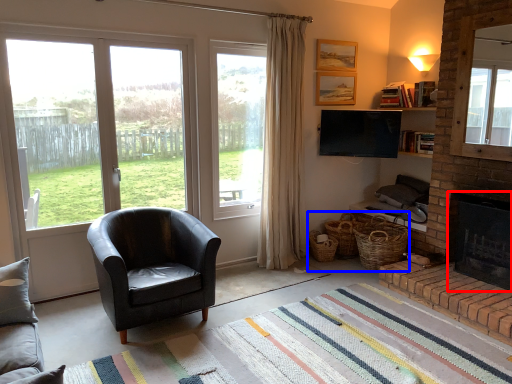
Question: Among these objects, which one is nearest to the camera, fireplace (highlighted by a red box) or basket (highlighted by a blue box)?

Choices:
 (A) fireplace
 (B) basket

Answer: (A)